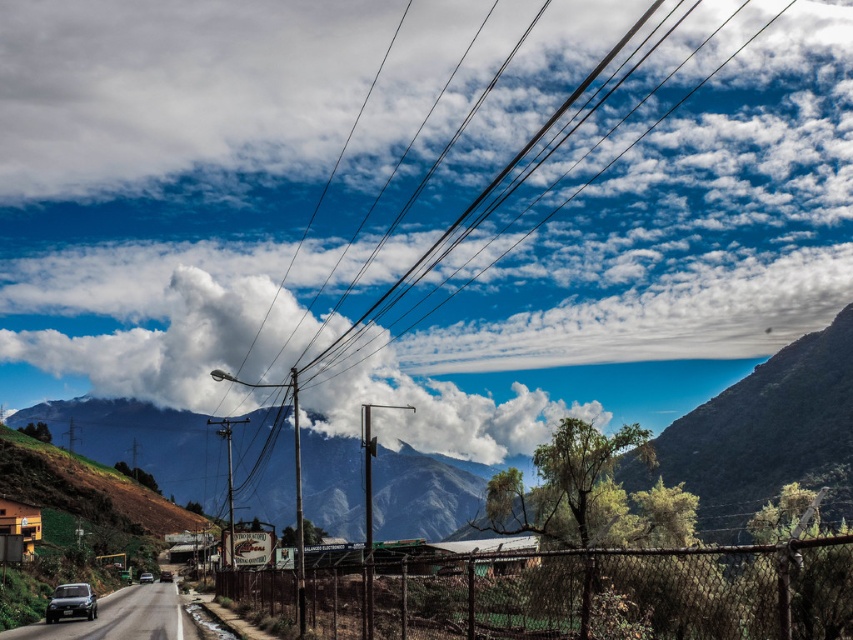
Does shiny black car at lower left have a greater height compared to metallic silver car at center?

Incorrect, shiny black car at lower left's height is not larger of metallic silver car at center's.

Between point (91, 611) and point (148, 577), which one is positioned in front?

Point (91, 611)

At what (x,y) coordinates should I click in order to perform the action: click on shiny black car at lower left. Please return your answer as a coordinate pair (x, y). This screenshot has width=853, height=640. Looking at the image, I should click on (71, 602).

I want to click on white fluffy cloud at upper center, so click(242, 173).

Is point (251, 371) positioned after point (79, 614)?

Yes, it is.

Is point (822, 234) farther from camera compared to point (74, 584)?

That is True.

Identify the location of white fluffy cloud at upper center. Image resolution: width=853 pixels, height=640 pixels. (242, 173).

Does white fluffy cloud at upper center have a greater height compared to metallic silver car at center?

Yes.

Does white fluffy cloud at upper center lie behind metallic silver car at center?

Yes, white fluffy cloud at upper center is further from the viewer.

Image resolution: width=853 pixels, height=640 pixels. What do you see at coordinates (242, 173) in the screenshot?
I see `white fluffy cloud at upper center` at bounding box center [242, 173].

Where is `white fluffy cloud at upper center`? white fluffy cloud at upper center is located at coordinates (242, 173).